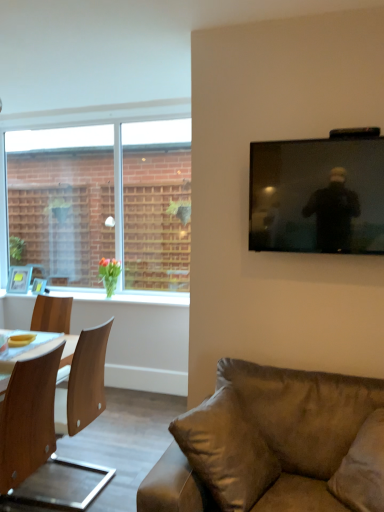
Describe the element at coordinates (226, 451) in the screenshot. The height and width of the screenshot is (512, 384). I see `brown suede pillow at lower right, which is the second pillow in right-to-left order` at that location.

What is the approximate width of yellow matte bowl at lower left?

yellow matte bowl at lower left is 4.51 inches wide.

Find the location of a particular element. green glossy vase at left is located at coordinates (109, 274).

The width and height of the screenshot is (384, 512). Identify the location of wooden photo frame at left, the 2th picture frame viewed from the right. (19, 279).

How much space does wooden photo frame at left, placed as the 1th picture frame when sorted from left to right, occupy horizontally?

wooden photo frame at left, placed as the 1th picture frame when sorted from left to right, is 4.74 inches wide.

This screenshot has width=384, height=512. In order to click on black glossy tv at upper right in this screenshot , I will do `click(317, 196)`.

Identify the location of brown leather couch at lower right. (275, 445).

From their relative heights in the image, would you say brown leather couch at lower right is taller or shorter than clear glass window at upper left?

brown leather couch at lower right is shorter than clear glass window at upper left.

From the image's perspective, would you say brown leather couch at lower right is shown under clear glass window at upper left?

Correct, brown leather couch at lower right appears lower than clear glass window at upper left in the image.

Is brown leather couch at lower right positioned far away from clear glass window at upper left?

Yes, brown leather couch at lower right is far from clear glass window at upper left.

Choose the correct answer: Is brown leather couch at lower right inside clear glass window at upper left or outside it?

Result: brown leather couch at lower right is located beyond the bounds of clear glass window at upper left.

Considering the sizes of brown suede pillow at lower right, which is the second pillow in right-to-left order, and yellow matte bowl at lower left in the image, is brown suede pillow at lower right, which is the second pillow in right-to-left order, taller or shorter than yellow matte bowl at lower left?

In the image, brown suede pillow at lower right, which is the second pillow in right-to-left order, appears to be taller than yellow matte bowl at lower left.

Considering the positions of objects brown suede pillow at lower right, which is counted as the 1th pillow, starting from the left, and yellow matte bowl at lower left in the image provided, who is more to the right, brown suede pillow at lower right, which is counted as the 1th pillow, starting from the left, or yellow matte bowl at lower left?

Positioned to the right is brown suede pillow at lower right, which is counted as the 1th pillow, starting from the left.

Is brown suede pillow at lower right, which is the second pillow in right-to-left order, touching yellow matte bowl at lower left?

No, brown suede pillow at lower right, which is the second pillow in right-to-left order, is not in contact with yellow matte bowl at lower left.

Is point (230, 423) in front of point (18, 344)?

Yes, it is in front of point (18, 344).

Is yellow matte bowl at lower left in contact with black glossy tv at upper right?

yellow matte bowl at lower left and black glossy tv at upper right are clearly separated.

Can you confirm if yellow matte bowl at lower left is shorter than black glossy tv at upper right?

Yes, yellow matte bowl at lower left is shorter than black glossy tv at upper right.

Is the position of yellow matte bowl at lower left less distant than that of black glossy tv at upper right?

That is False.

Which is in front, point (32, 336) or point (256, 217)?

Point (256, 217)

Based on their positions, is black glossy tv at upper right located to the left or right of wooden picture frame at left, which ranks as the first picture frame in right-to-left order?

From the image, it's evident that black glossy tv at upper right is to the right of wooden picture frame at left, which ranks as the first picture frame in right-to-left order.

Is black glossy tv at upper right facing away from wooden picture frame at left, which is the second picture frame from left to right?

No, black glossy tv at upper right is not facing the opposite direction of wooden picture frame at left, which is the second picture frame from left to right.

Is black glossy tv at upper right smaller than wooden picture frame at left, which ranks as the first picture frame in right-to-left order?

No.

Is the depth of black glossy tv at upper right less than that of wooden picture frame at left, which is the second picture frame from left to right?

Yes.

Who is bigger, suede-like beige pillow at lower right, which ranks as the 2th pillow in left-to-right order, or green glossy vase at left?

Bigger between the two is suede-like beige pillow at lower right, which ranks as the 2th pillow in left-to-right order.

From a real-world perspective, is suede-like beige pillow at lower right, which ranks as the 2th pillow in left-to-right order, below green glossy vase at left?

Yes, from a real-world perspective, suede-like beige pillow at lower right, which ranks as the 2th pillow in left-to-right order, is below green glossy vase at left.

Is the position of suede-like beige pillow at lower right, which ranks as the 2th pillow in left-to-right order, more distant than that of green glossy vase at left?

No, it is in front of green glossy vase at left.

Locate an element on the screen. The image size is (384, 512). the 2nd pillow to the right when counting from the green glossy vase at left is located at coordinates (363, 468).

Based on the photo, which of these two, brown leather couch at lower right or wooden chair at left, is wider?

brown leather couch at lower right is wider.

From the image's perspective, is brown leather couch at lower right on wooden chair at left?

Incorrect, from the image's perspective, brown leather couch at lower right is lower than wooden chair at left.

How different are the orientations of brown leather couch at lower right and wooden chair at left in degrees?

The angular difference between brown leather couch at lower right and wooden chair at left is 87 degrees.

Find the location of `chair lying on the left of brown leather couch at lower right`. chair lying on the left of brown leather couch at lower right is located at coordinates (87, 379).

Can you confirm if black glossy tv at upper right is positioned to the left of brown suede pillow at lower right, which is the second pillow in right-to-left order?

No.

Is black glossy tv at upper right in contact with brown suede pillow at lower right, which is the second pillow in right-to-left order?

They are not placed beside each other.

How different are the orientations of black glossy tv at upper right and brown suede pillow at lower right, which is the second pillow in right-to-left order, in degrees?

There is a 72.7-degree angle between the facing directions of black glossy tv at upper right and brown suede pillow at lower right, which is the second pillow in right-to-left order.

Which is behind, point (330, 157) or point (193, 466)?

The point (330, 157) is farther.

This screenshot has width=384, height=512. Find the location of `window behind the brown leather couch at lower right`. window behind the brown leather couch at lower right is located at coordinates (102, 203).

Find the location of a particular element. This screenshot has height=512, width=384. pillow that is the 1st object directly below the yellow matte bowl at lower left (from a real-world perspective) is located at coordinates (226, 451).

Considering their positions, is wooden photo frame at left, the 2th picture frame viewed from the right, positioned further to brown suede pillow at lower right, which is counted as the 1th pillow, starting from the left, than clear glass window at upper left?

The object further to brown suede pillow at lower right, which is counted as the 1th pillow, starting from the left, is clear glass window at upper left.

Estimate the real-world distances between objects in this image. Which object is closer to wooden chair at left, brown leather couch at lower right or yellow matte bowl at lower left?

yellow matte bowl at lower left.

Estimate the real-world distances between objects in this image. Which object is closer to black glossy tv at upper right, clear glass window at upper left or wooden photo frame at left, placed as the 1th picture frame when sorted from left to right?

wooden photo frame at left, placed as the 1th picture frame when sorted from left to right, is closer to black glossy tv at upper right.

Which object lies nearer to the anchor point wooden picture frame at left, which is the second picture frame from left to right, yellow matte bowl at lower left or wooden chair at left?

yellow matte bowl at lower left lies closer to wooden picture frame at left, which is the second picture frame from left to right, than the other object.

Which object lies further to the anchor point yellow matte bowl at lower left, wooden photo frame at left, placed as the 1th picture frame when sorted from left to right, or black glossy tv at upper right?

The object further to yellow matte bowl at lower left is black glossy tv at upper right.

Considering their positions, is brown suede pillow at lower right, which is counted as the 1th pillow, starting from the left, positioned further to black glossy tv at upper right than wooden photo frame at left, the 2th picture frame viewed from the right?

Among the two, wooden photo frame at left, the 2th picture frame viewed from the right, is located further to black glossy tv at upper right.

From the image, which object appears to be nearer to wooden chair at left, yellow matte bowl at lower left or green glossy vase at left?

yellow matte bowl at lower left lies closer to wooden chair at left than the other object.

When comparing their distances from wooden chair at left, does wooden picture frame at left, which is the second picture frame from left to right, or suede-like beige pillow at lower right, marked as the first pillow in a right-to-left arrangement, seem closer?

suede-like beige pillow at lower right, marked as the first pillow in a right-to-left arrangement, lies closer to wooden chair at left than the other object.

Locate an element on the screen. bowl between black glossy tv at upper right and wooden picture frame at left, which is the second picture frame from left to right, in the front-back direction is located at coordinates (21, 340).

This screenshot has width=384, height=512. Identify the location of television between brown leather couch at lower right and wooden photo frame at left, the 2th picture frame viewed from the right, in the front-back direction. (317, 196).

Locate an element on the screen. The image size is (384, 512). television positioned between suede-like beige pillow at lower right, marked as the first pillow in a right-to-left arrangement, and clear glass window at upper left from near to far is located at coordinates (317, 196).

Locate an element on the screen. The width and height of the screenshot is (384, 512). television between brown suede pillow at lower right, which is the second pillow in right-to-left order, and green glossy vase at left in the front-back direction is located at coordinates (317, 196).